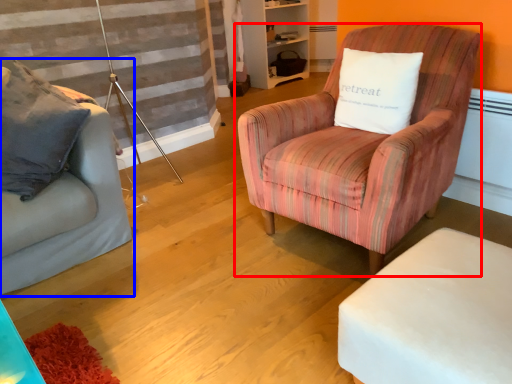
Question: Which object appears closest to the camera in this image, chair (highlighted by a red box) or studio couch (highlighted by a blue box)?

Choices:
 (A) chair
 (B) studio couch

Answer: (A)